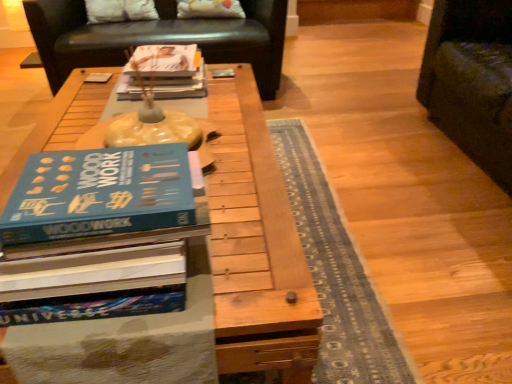
This screenshot has height=384, width=512. Find the location of `matte paper book at center`. matte paper book at center is located at coordinates (180, 83).

What do you see at coordinates (120, 10) in the screenshot?
I see `white fabric pillow at upper center, which is counted as the first pillow, starting from the left` at bounding box center [120, 10].

This screenshot has height=384, width=512. Describe the element at coordinates (258, 246) in the screenshot. I see `wooden table at center` at that location.

The image size is (512, 384). Describe the element at coordinates (209, 9) in the screenshot. I see `white fabric pillow at upper center, the second pillow viewed from the left` at that location.

Find the location of a particular element. This screenshot has width=512, height=384. matte paper book at center is located at coordinates (180, 83).

Does point (94, 22) appear closer or farther from the camera than point (174, 93)?

Point (94, 22) is farther from the camera than point (174, 93).

Based on their sizes in the image, would you say white fabric pillow at upper center, which is counted as the first pillow, starting from the left, is bigger or smaller than matte paper book at center?

Considering their sizes, white fabric pillow at upper center, which is counted as the first pillow, starting from the left, takes up more space than matte paper book at center.

Can you confirm if white fabric pillow at upper center, which is counted as the first pillow, starting from the left, is positioned to the right of matte paper book at center?

Incorrect, white fabric pillow at upper center, which is counted as the first pillow, starting from the left, is not on the right side of matte paper book at center.

The height and width of the screenshot is (384, 512). Find the location of `book behind the wooden table at center`. book behind the wooden table at center is located at coordinates (180, 83).

Is wooden table at center next to matte paper book at center?

No, wooden table at center is not next to matte paper book at center.

From a real-world perspective, is wooden table at center on matte paper book at center?

No, from a real-world perspective, wooden table at center is not above matte paper book at center.

From the image's perspective, does wooden table at center appear higher than matte paper book at center?

No, from the image's perspective, wooden table at center is not on top of matte paper book at center.

Is matte paper book at center at the left side of white fabric pillow at upper center, which is counted as the first pillow, starting from the left?

Incorrect, matte paper book at center is not on the left side of white fabric pillow at upper center, which is counted as the first pillow, starting from the left.

From the picture: Between matte paper book at center and white fabric pillow at upper center, the 2th pillow viewed from the right, which one has smaller size?

Smaller between the two is matte paper book at center.

From a real-world perspective, is matte paper book at center beneath white fabric pillow at upper center, the 2th pillow viewed from the right?

No, from a real-world perspective, matte paper book at center is not under white fabric pillow at upper center, the 2th pillow viewed from the right.

From the picture: Is black leather couch at upper center in contact with white fabric pillow at upper center, which is counted as the first pillow, starting from the left?

black leather couch at upper center and white fabric pillow at upper center, which is counted as the first pillow, starting from the left, are clearly separated.

At what (x,y) coordinates should I click in order to perform the action: click on chair on the right of white fabric pillow at upper center, the 2th pillow viewed from the right. Please return your answer as a coordinate pair (x, y). Looking at the image, I should click on (158, 38).

From a real-world perspective, is black leather couch at upper center on top of white fabric pillow at upper center, the 2th pillow viewed from the right?

No, from a real-world perspective, black leather couch at upper center is not above white fabric pillow at upper center, the 2th pillow viewed from the right.

Considering the relative sizes of black leather couch at upper center and matte paper book at center in the image provided, is black leather couch at upper center wider than matte paper book at center?

Yes.

In the scene shown: From the image's perspective, between black leather couch at upper center and matte paper book at center, which one is located above?

black leather couch at upper center.

Based on the photo, is black leather couch at upper center bigger or smaller than matte paper book at center?

Clearly, black leather couch at upper center is larger in size than matte paper book at center.

Image resolution: width=512 pixels, height=384 pixels. In order to click on chair on the left of matte paper book at center in this screenshot , I will do `click(158, 38)`.

Based on their positions, is white fabric pillow at upper center, the second pillow viewed from the left, located to the left or right of matte paper book at center?

white fabric pillow at upper center, the second pillow viewed from the left, is to the right of matte paper book at center.

In the scene shown: From a real-world perspective, does white fabric pillow at upper center, the second pillow viewed from the left, sit lower than matte paper book at center?

Yes, from a real-world perspective, white fabric pillow at upper center, the second pillow viewed from the left, is under matte paper book at center.

Considering the positions of objects white fabric pillow at upper center, the second pillow viewed from the left, and matte paper book at center in the image provided, who is in front, white fabric pillow at upper center, the second pillow viewed from the left, or matte paper book at center?

matte paper book at center is more forward.

In terms of height, does white fabric pillow at upper center, positioned as the 1th pillow in right-to-left order, look taller or shorter compared to matte paper book at center?

Considering their sizes, white fabric pillow at upper center, positioned as the 1th pillow in right-to-left order, has more height than matte paper book at center.

Would you say wooden table at center contains black leather couch at upper center?

Definitely not — black leather couch at upper center is not inside wooden table at center.

Does wooden table at center turn towards black leather couch at upper center?

No, wooden table at center is not turned towards black leather couch at upper center.

Find the location of a particular element. table on the right of black leather couch at upper center is located at coordinates (258, 246).

Does point (271, 200) lie behind point (274, 72)?

That is False.

Which pillow is the 1st one when counting from the back of the matte paper book at center? Please provide its 2D coordinates.

[(120, 10)]

Find the location of a particular element. The width and height of the screenshot is (512, 384). book located above the wooden table at center (from a real-world perspective) is located at coordinates (180, 83).

Looking at the image, which one is located further to black leather couch at upper center, white fabric pillow at upper center, the second pillow viewed from the left, or matte paper book at center?

matte paper book at center lies further to black leather couch at upper center than the other object.

Which object lies nearer to the anchor point black leather couch at upper center, white fabric pillow at upper center, which is counted as the first pillow, starting from the left, or white fabric pillow at upper center, positioned as the 1th pillow in right-to-left order?

white fabric pillow at upper center, positioned as the 1th pillow in right-to-left order.

Considering their positions, is matte paper book at center positioned further to white fabric pillow at upper center, positioned as the 1th pillow in right-to-left order, than wooden table at center?

wooden table at center is further to white fabric pillow at upper center, positioned as the 1th pillow in right-to-left order.

From the image, which object appears to be farther from black leather couch at upper center, white fabric pillow at upper center, the 2th pillow viewed from the right, or wooden table at center?

Among the two, wooden table at center is located further to black leather couch at upper center.

From the image, which object appears to be farther from wooden table at center, white fabric pillow at upper center, the second pillow viewed from the left, or matte paper book at center?

white fabric pillow at upper center, the second pillow viewed from the left, is positioned further to the anchor wooden table at center.

Looking at the image, which one is located closer to matte paper book at center, white fabric pillow at upper center, positioned as the 1th pillow in right-to-left order, or black leather couch at upper center?

The object closer to matte paper book at center is black leather couch at upper center.

Looking at the image, which one is located closer to white fabric pillow at upper center, positioned as the 1th pillow in right-to-left order, black leather couch at upper center or wooden table at center?

black leather couch at upper center.

Looking at the image, which one is located further to matte paper book at center, white fabric pillow at upper center, positioned as the 1th pillow in right-to-left order, or white fabric pillow at upper center, which is counted as the first pillow, starting from the left?

white fabric pillow at upper center, which is counted as the first pillow, starting from the left.

Identify the location of book between wooden table at center and white fabric pillow at upper center, the second pillow viewed from the left, along the z-axis. This screenshot has height=384, width=512. (180, 83).

In order to click on book between wooden table at center and white fabric pillow at upper center, the 2th pillow viewed from the right, in the front-back direction in this screenshot , I will do `click(180, 83)`.

At what (x,y) coordinates should I click in order to perform the action: click on book between wooden table at center and black leather couch at upper center along the z-axis. Please return your answer as a coordinate pair (x, y). Looking at the image, I should click on (180, 83).

I want to click on chair between matte paper book at center and white fabric pillow at upper center, which is counted as the first pillow, starting from the left, from front to back, so click(158, 38).